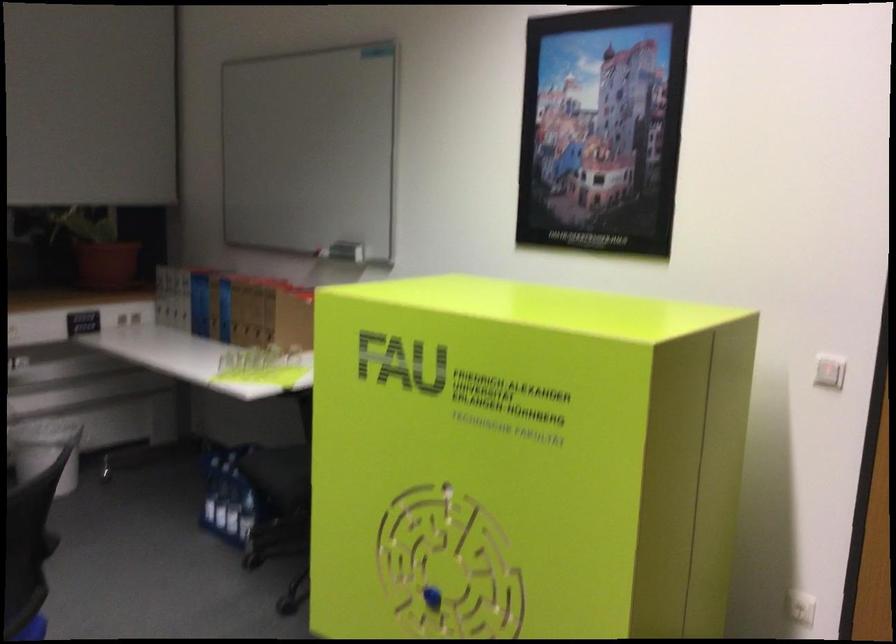
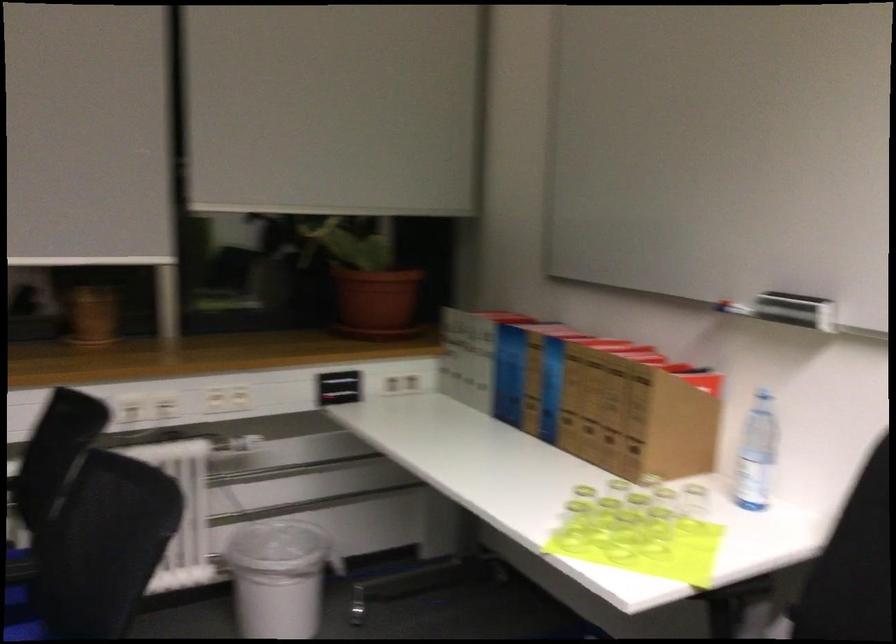
In the second image, find the point that corresponds to point (349, 249) in the first image.

(795, 310)